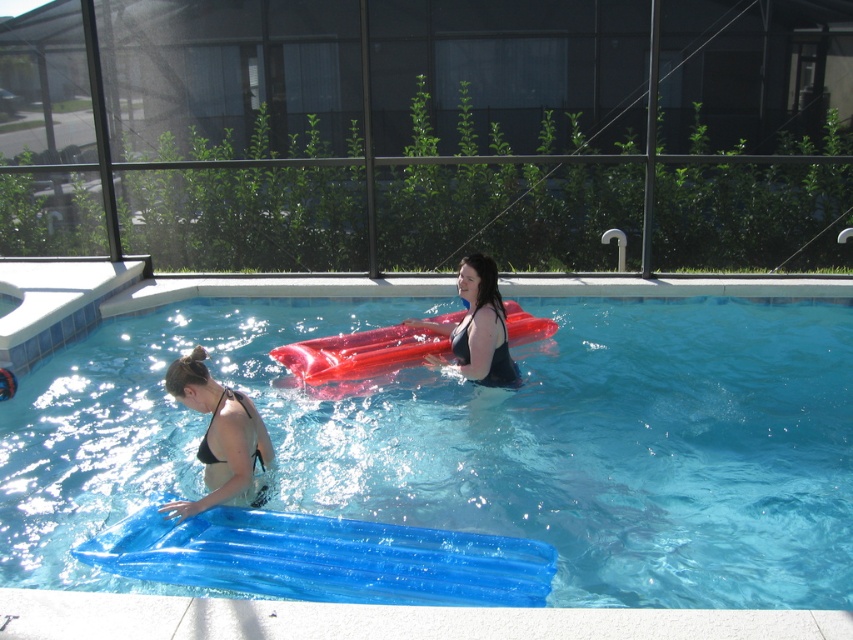
You are standing at the edge of the pool and looking towards the center. There are two points marked in the image, point 1 at coordinates point (715,520) and point 2 at coordinates point (173,368). Which point is closer to you?

Point (173,368) is closer to you because it is nearer to the camera than point (715,520).

You are a lifeguard who needs to determine if the rubberized red raft at center can fit entirely within the space occupied by the matte black swimsuit at center. Based on the scene description, can it?

The rubberized red raft at center is wider than the matte black swimsuit at center, so it cannot fit entirely within the space occupied by the matte black swimsuit at center.

From the picture: You are a lifeguard standing at the pool deck. You need to locate the transparent blue float at center. Where exactly is it positioned in the pool?

The transparent blue float at center is positioned at point 0.694 in the x coordinate and 0.564 in the y coordinate.